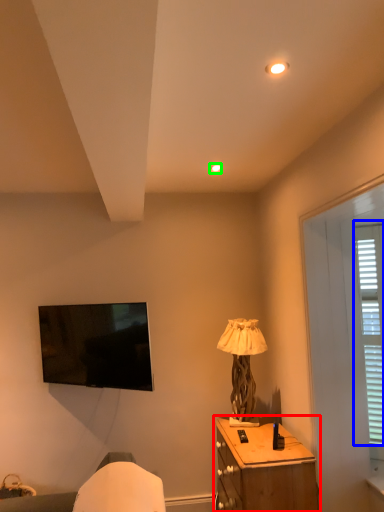
Question: Based on their relative distances, which object is nearer to nightstand (highlighted by a red box)? Choose from bay window (highlighted by a blue box) and lighting (highlighted by a green box).

Choices:
 (A) bay window
 (B) lighting

Answer: (A)